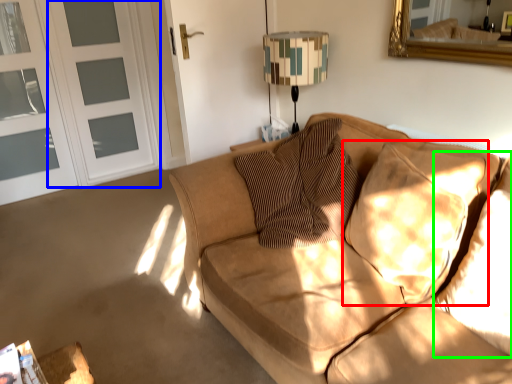
Question: Considering the real-world distances, which object is farthest from pillow (highlighted by a red box)? screen door (highlighted by a blue box) or pillow (highlighted by a green box)?

Choices:
 (A) screen door
 (B) pillow

Answer: (A)